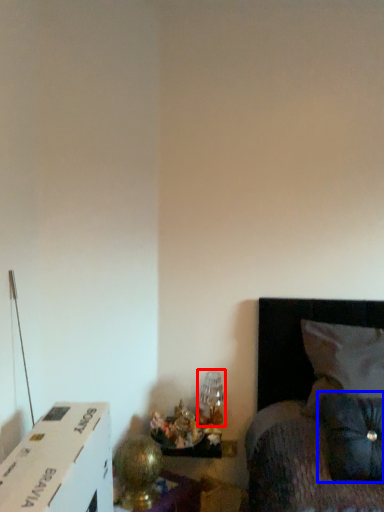
Question: Which object is closer to the camera taking this photo, table lamp (highlighted by a red box) or pillow (highlighted by a blue box)?

Choices:
 (A) table lamp
 (B) pillow

Answer: (B)